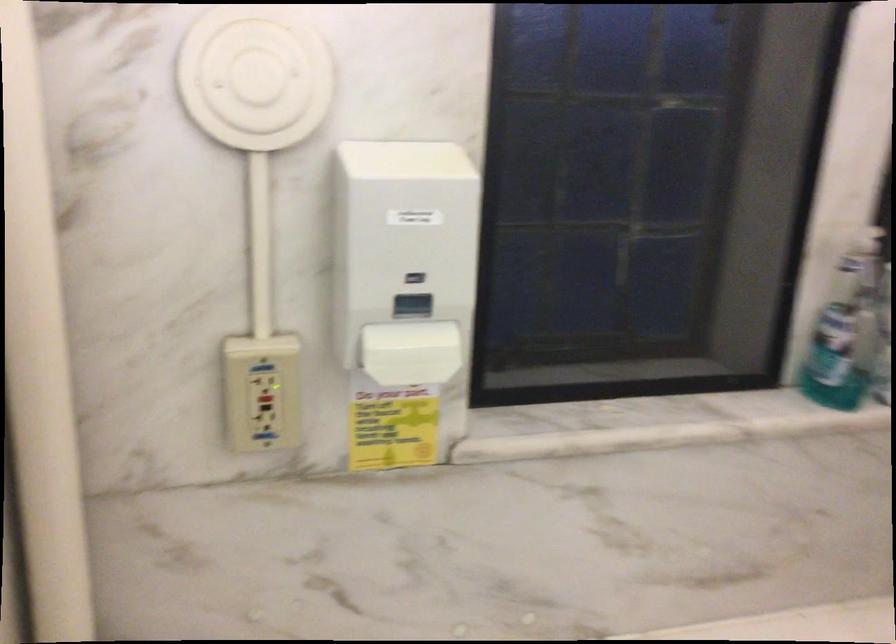
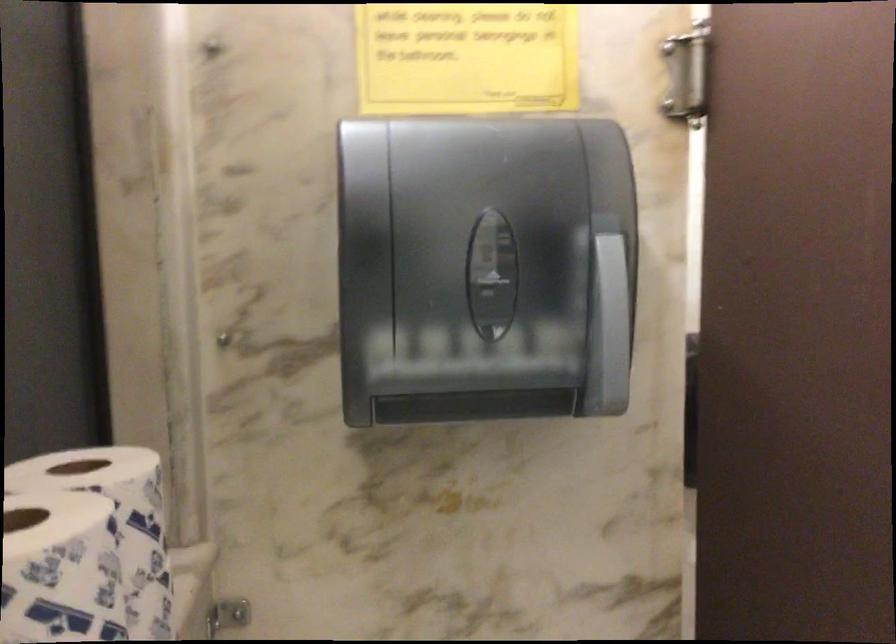
Question: The images are taken continuously from a first-person perspective. In which direction is your viewpoint rotating?

Choices:
 (A) Left
 (B) Right
 (C) Up
 (D) Down

Answer: (B)